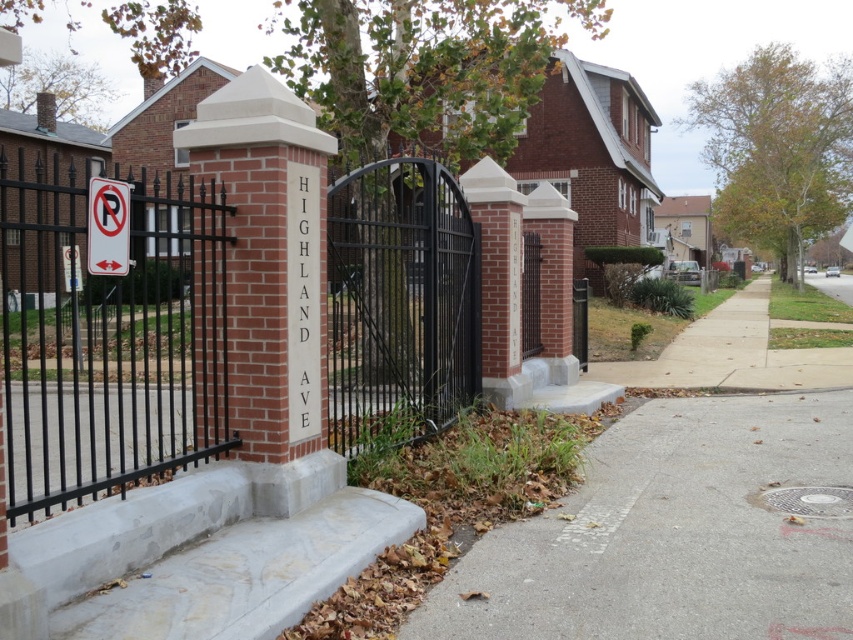
You are a delivery driver approaching the property and need to determine where to park your vehicle. According to the scene, the black wrought iron gate at left and the gray concrete sidewalk at lower right are positioned in a specific way. Can you identify which object is higher in elevation compared to the other?

The black wrought iron gate at left is above gray concrete sidewalk at lower right, meaning the gate is higher in elevation than the sidewalk.

You are a delivery person approaching the gated entrance on Highland Ave. You need to park your vehicle on the gray concrete sidewalk at lower right. What coordinates should you aim for to park correctly?

The gray concrete sidewalk at lower right is located at coordinates point (x=675, y=532). Park there.

You are a delivery driver trying to enter the property through the black wrought iron gate at left. Your delivery truck is 2 meters wide. The gray concrete sidewalk at lower right is 1.5 meters wide. Can your truck pass through the gate?

The black wrought iron gate at left is wider than the gray concrete sidewalk at lower right. Since the sidewalk is 1.5 meters wide and the gate is wider than that, the truck which is 2 meters wide can pass through the gate as long as the gate width is at least 2 meters. However, the exact gate width isn not specified, but since it is wider than the sidewalk, which is 1.5m, it might be possible. But without knowing the exact gate width, we can only assume it is wider than 1.5m. If the gate is wider than 2m,